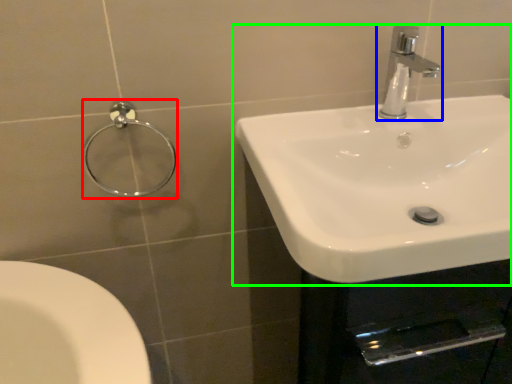
Question: Which object is positioned closest to shower (highlighted by a red box)? Select from tap (highlighted by a blue box) and sink (highlighted by a green box).

Choices:
 (A) tap
 (B) sink

Answer: (B)